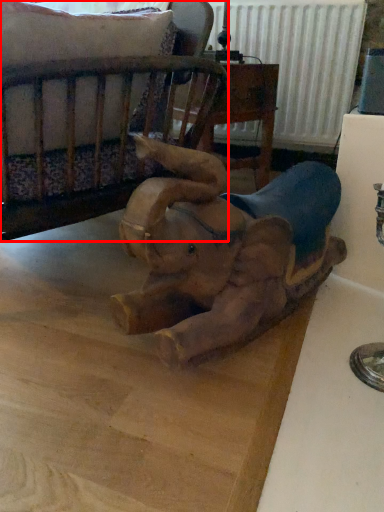
Question: In this image, where is furniture (annotated by the red box) located relative to elephant?

Choices:
 (A) left
 (B) right

Answer: (A)